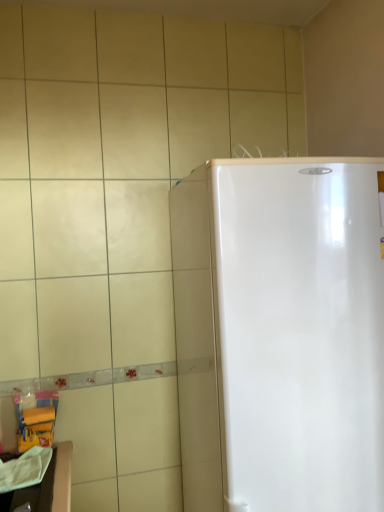
Question: Is white glossy refrigerator at right to the left or to the right of white glossy counter top at lower left in the image?

Choices:
 (A) left
 (B) right

Answer: (B)

Question: In terms of height, does white glossy refrigerator at right look taller or shorter compared to white glossy counter top at lower left?

Choices:
 (A) short
 (B) tall

Answer: (B)

Question: Is white glossy refrigerator at right wider or thinner than white glossy counter top at lower left?

Choices:
 (A) wide
 (B) thin

Answer: (A)

Question: Considering the positions of point pos(29,496) and point pos(221,165), is point pos(29,496) closer or farther from the camera than point pos(221,165)?

Choices:
 (A) farther
 (B) closer

Answer: (A)

Question: Relative to white glossy refrigerator at right, is white glossy counter top at lower left in front or behind?

Choices:
 (A) behind
 (B) front

Answer: (A)

Question: Considering the relative positions of white glossy counter top at lower left and white glossy refrigerator at right in the image provided, is white glossy counter top at lower left to the left or to the right of white glossy refrigerator at right?

Choices:
 (A) left
 (B) right

Answer: (A)

Question: From a real-world perspective, relative to white glossy refrigerator at right, is white glossy counter top at lower left vertically above or below?

Choices:
 (A) below
 (B) above

Answer: (A)